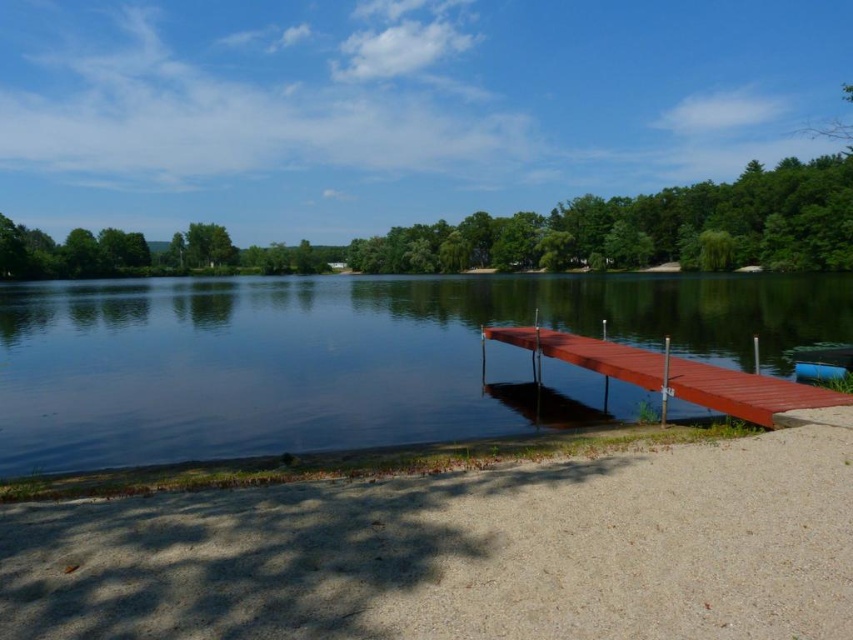
Is the position of smooth wood dock at lower right less distant than that of blue plastic boat at lower right?

That is True.

Which of these two, smooth wood dock at lower right or blue plastic boat at lower right, stands shorter?

blue plastic boat at lower right is shorter.

Between point (706, 376) and point (834, 368), which one is positioned behind?

The point (834, 368) is more distant.

Locate an element on the screen. The image size is (853, 640). smooth wood dock at lower right is located at coordinates (669, 374).

Can you confirm if smooth water at center is shorter than blue plastic boat at lower right?

No.

Is smooth water at center thinner than blue plastic boat at lower right?

In fact, smooth water at center might be wider than blue plastic boat at lower right.

Between point (213, 452) and point (809, 378), which one is positioned behind?

The point (809, 378) is behind.

At what (x,y) coordinates should I click in order to perform the action: click on smooth water at center. Please return your answer as a coordinate pair (x, y). This screenshot has height=640, width=853. Looking at the image, I should click on (341, 355).

Who is lower down, smooth water at center or smooth wood dock at lower right?

smooth wood dock at lower right is below.

Does smooth water at center appear under smooth wood dock at lower right?

No, smooth water at center is not below smooth wood dock at lower right.

Who is more distant from viewer, (477, 292) or (669, 392)?

The point (477, 292) is behind.

Locate an element on the screen. The image size is (853, 640). smooth water at center is located at coordinates (341, 355).